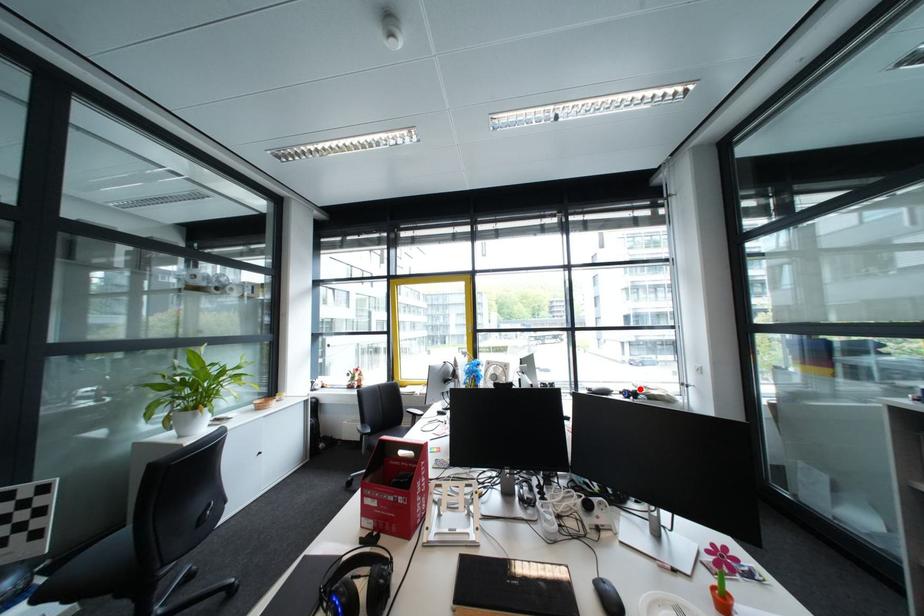
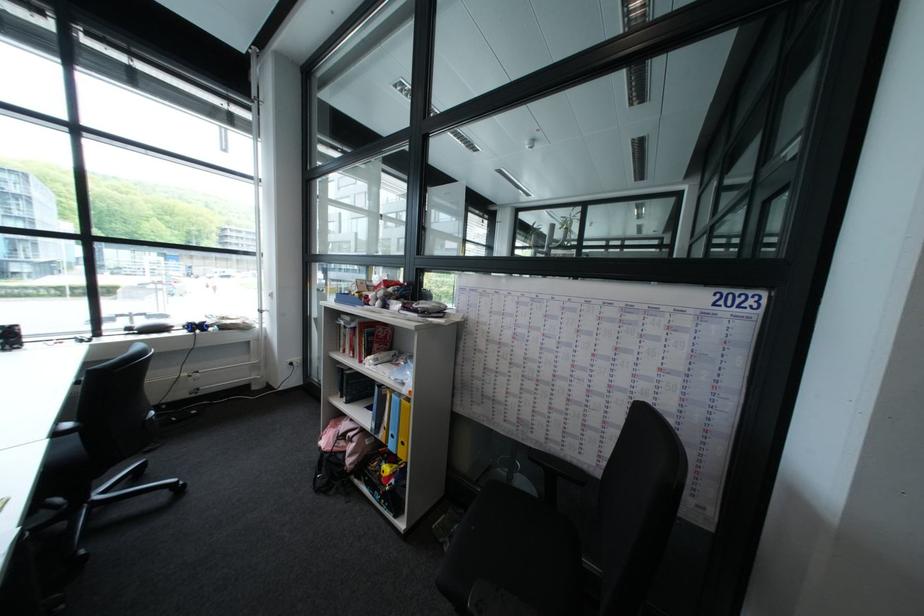
Question: I am providing you with two images of the same scene from different viewpoints. A red point is shown in image1. For the corresponding object point in image2, is it positioned nearer or farther from the camera?

Choices:
 (A) Nearer
 (B) Farther

Answer: (B)